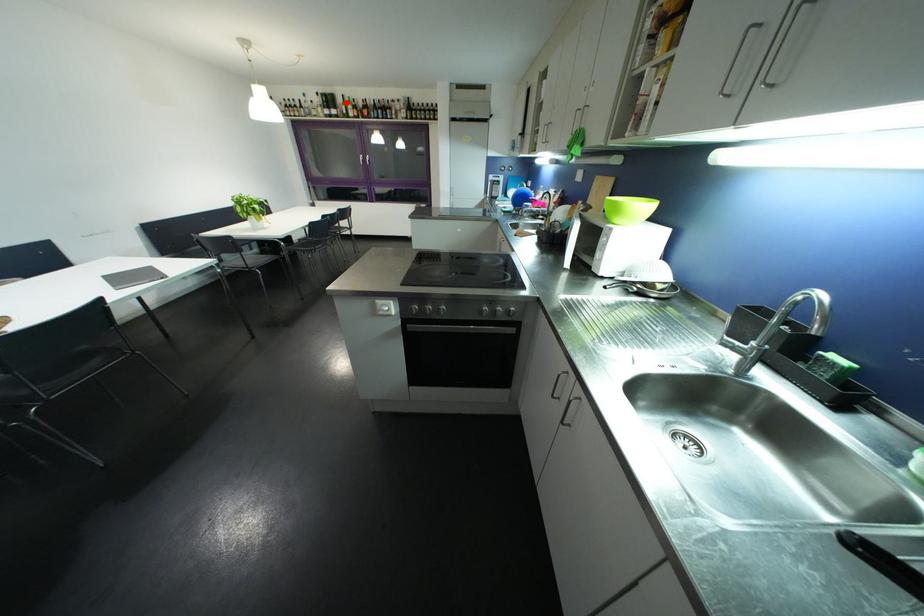
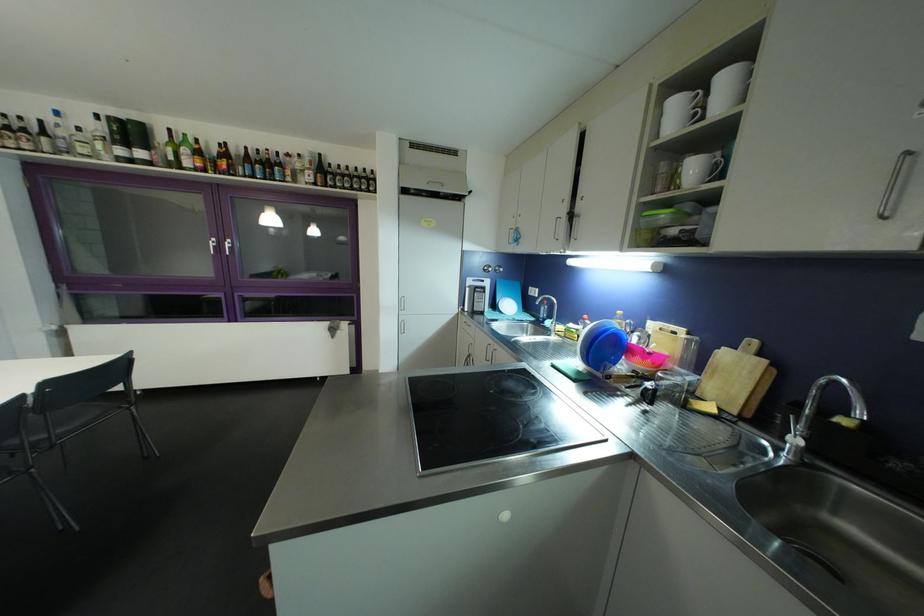
Question: I am providing you with two images of the same scene from different viewpoints. In image1, a red point is highlighted. Considering the same 3D point in image2, which of the following is correct?

Choices:
 (A) It is closer
 (B) It is farther

Answer: (B)